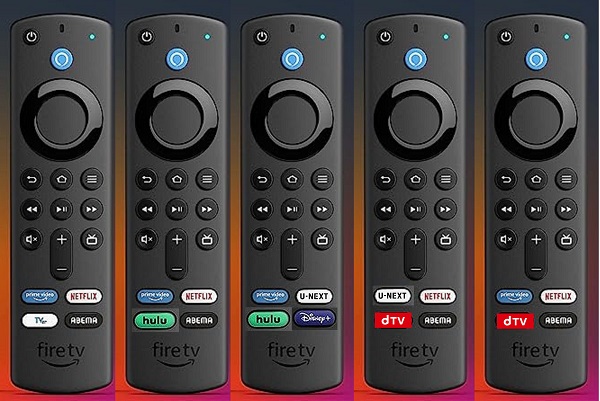
Find the location of a particular element. "fire tv" is located at coordinates (173, 350), (58, 352), (289, 350), (414, 354), (536, 353).